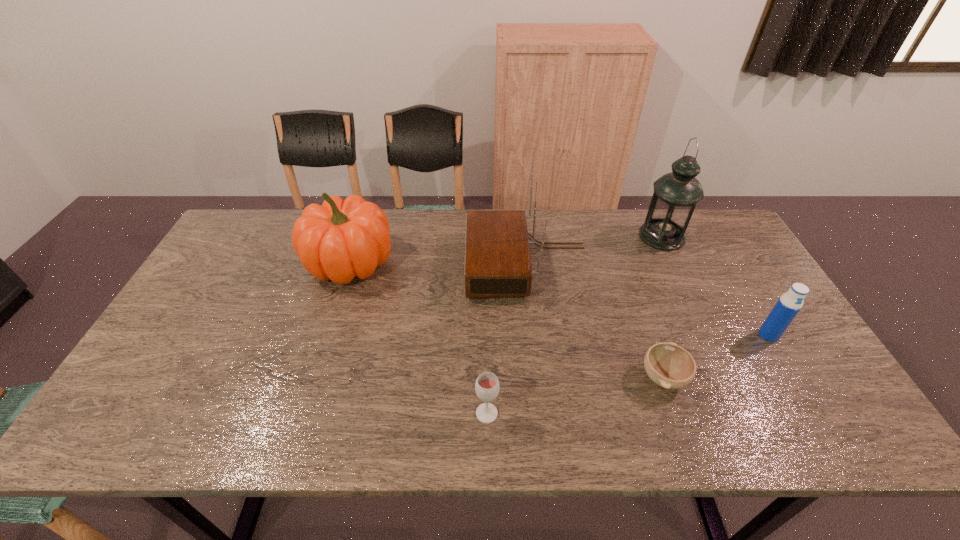
Locate an element on the screen. object that ranks as the third closest to the third tallest object is located at coordinates (668, 365).

At what (x,y) coordinates should I click in order to perform the action: click on the closest object relative to the fourth shortest object. Please return your answer as a coordinate pair (x, y). Looking at the image, I should click on (497, 256).

Identify the location of free location that satisfies the following two spatial constraints: 1. on the back side of the oil lamp; 2. on the left side of the second nearest object. The image size is (960, 540). (614, 237).

Where is `free spot that satisfies the following two spatial constraints: 1. on the front side of the fifth object from left to right; 2. on the front panel of the radio_receiver`? free spot that satisfies the following two spatial constraints: 1. on the front side of the fifth object from left to right; 2. on the front panel of the radio_receiver is located at coordinates (674, 264).

I want to click on free space that satisfies the following two spatial constraints: 1. on the front side of the third shortest object; 2. on the right side of the second object from right to left, so click(708, 335).